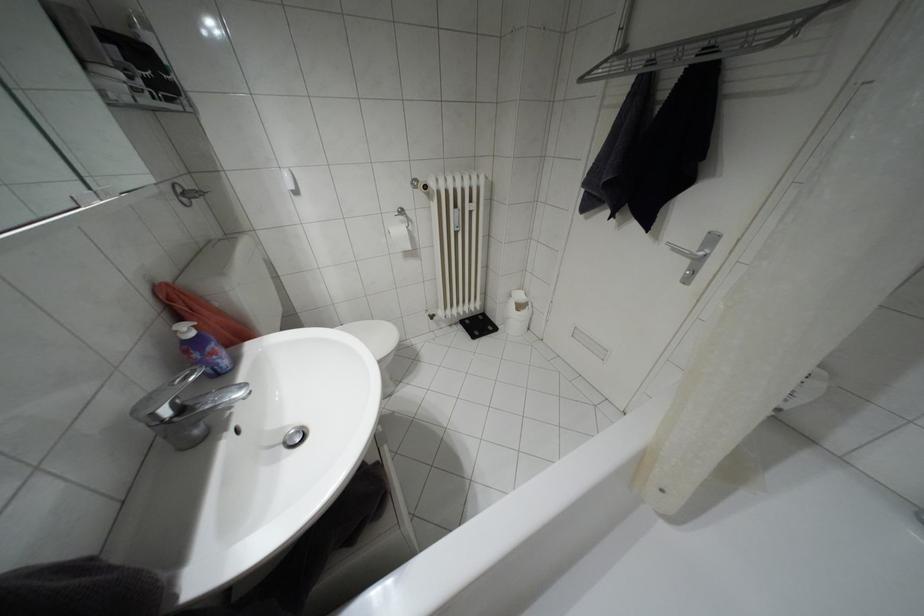
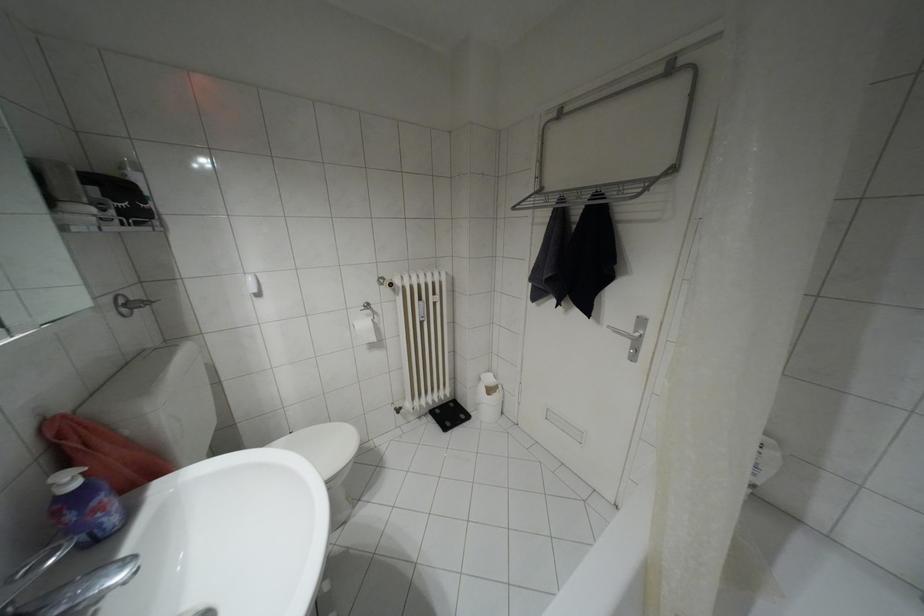
Question: How did the camera likely rotate?

Choices:
 (A) Left
 (B) Right
 (C) Up
 (D) Down

Answer: (C)